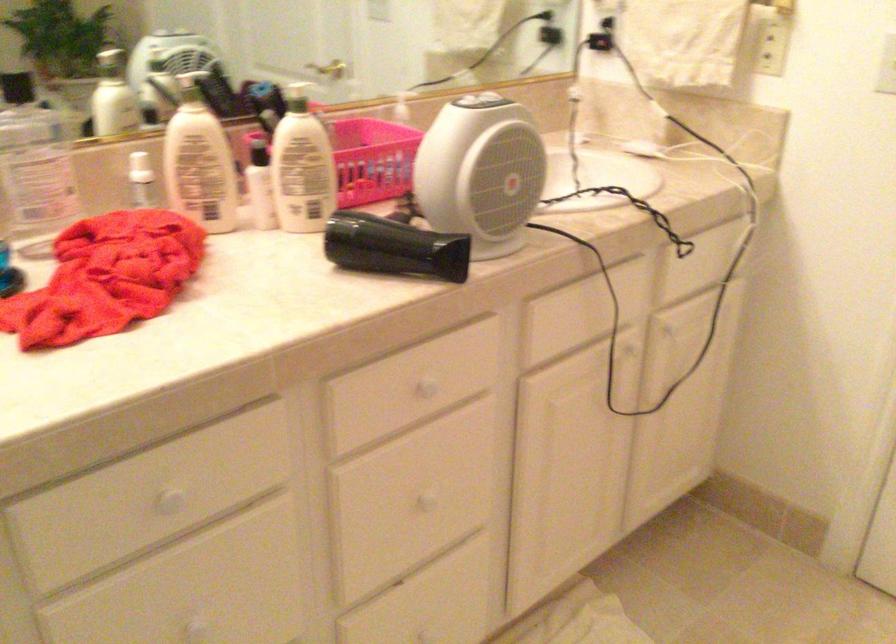
Image resolution: width=896 pixels, height=644 pixels. Find the location of `heater dial`. heater dial is located at coordinates (484, 102).